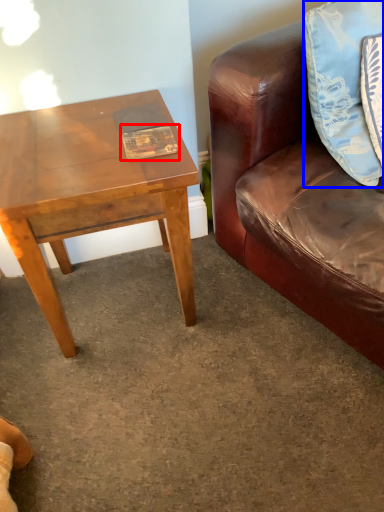
Question: Which object appears farthest to the camera in this image, book (highlighted by a red box) or pillow (highlighted by a blue box)?

Choices:
 (A) book
 (B) pillow

Answer: (A)